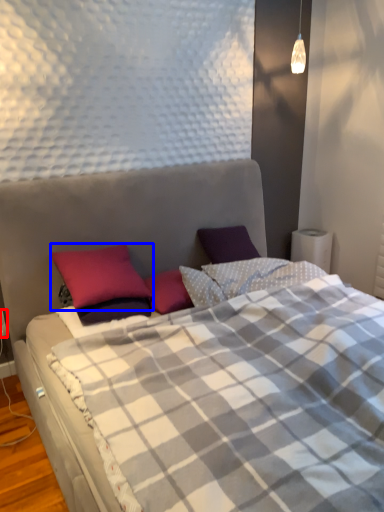
Question: Which object appears closest to the camera in this image, electric outlet (highlighted by a red box) or pillow (highlighted by a blue box)?

Choices:
 (A) electric outlet
 (B) pillow

Answer: (B)